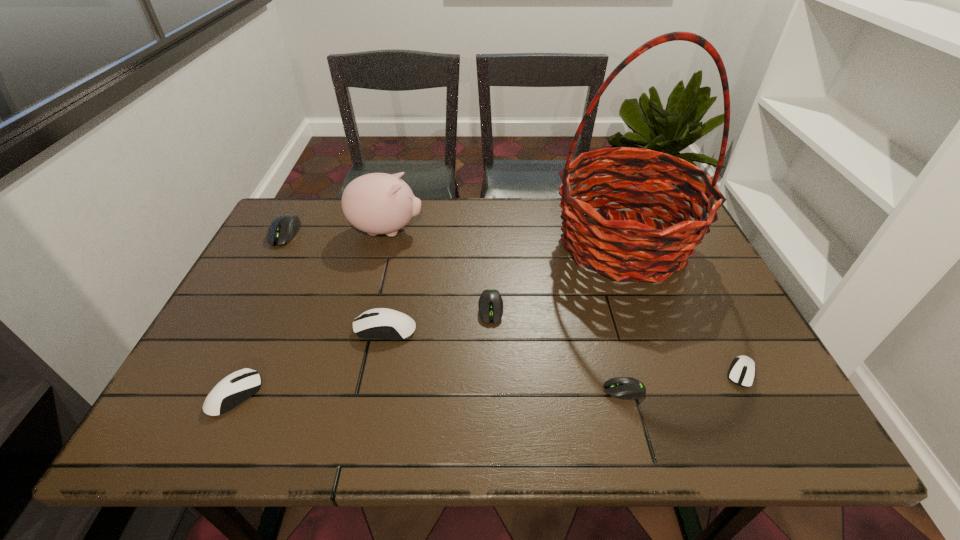
You are a GUI agent. You are given a task and a screenshot of the screen. Output one action in this format:
    pyautogui.click(x=<x>, y=<y>)
    Task: Click on the vacant space situated on the wheel side of the shortest computer mouse
    This screenshot has width=960, height=540.
    Given the screenshot: What is the action you would take?
    pyautogui.click(x=552, y=390)

In order to click on vacant point located on the wheel side of the shortest computer mouse in this screenshot , I will do pos(510,390).

Where is `vacant area situated on the wheel side of the shortest computer mouse`? This screenshot has height=540, width=960. vacant area situated on the wheel side of the shortest computer mouse is located at coordinates (510, 390).

Identify the location of basket that is at the far edge. (654, 251).

At what (x,y) coordinates should I click in order to perform the action: click on piggy bank situated at the far edge. Please return your answer as a coordinate pair (x, y). This screenshot has height=540, width=960. Looking at the image, I should click on (377, 203).

You are a GUI agent. You are given a task and a screenshot of the screen. Output one action in this format:
    pyautogui.click(x=<x>, y=<y>)
    Task: Click on the computer mouse that is at the far edge
    
    Given the screenshot: What is the action you would take?
    pyautogui.click(x=283, y=229)

Find the location of a particular element. Image resolution: width=960 pixels, height=540 pixels. object that is at the near edge is located at coordinates (235, 388).

Locate an element on the screen. Image resolution: width=960 pixels, height=540 pixels. basket that is at the right edge is located at coordinates (654, 251).

Identify the location of mouse that is at the right edge. The image size is (960, 540). (742, 371).

Find the location of `object that is at the far left corner`. object that is at the far left corner is located at coordinates (283, 229).